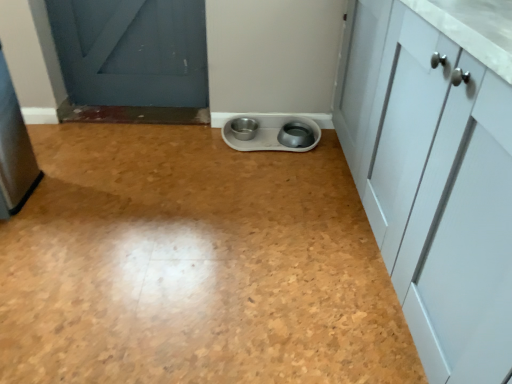
Question: Is metallic gray bowls at center, positioned as the 2th appliance in front-to-back order, touching brushed metal refrigerator at left, marked as the second appliance in a right-to-left arrangement?

Choices:
 (A) yes
 (B) no

Answer: (B)

Question: Can you confirm if metallic gray bowls at center, acting as the 1th appliance starting from the right, is positioned to the right of brushed metal refrigerator at left, marked as the first appliance in a left-to-right arrangement?

Choices:
 (A) yes
 (B) no

Answer: (A)

Question: Can you confirm if metallic gray bowls at center, arranged as the first appliance when viewed from the back, is smaller than brushed metal refrigerator at left, marked as the second appliance in a right-to-left arrangement?

Choices:
 (A) yes
 (B) no

Answer: (A)

Question: Is metallic gray bowls at center, the second appliance in the left-to-right sequence, outside of brushed metal refrigerator at left, the 2th appliance when ordered from back to front?

Choices:
 (A) no
 (B) yes

Answer: (B)

Question: Does metallic gray bowls at center, arranged as the first appliance when viewed from the back, have a lesser width compared to brushed metal refrigerator at left, positioned as the 1th appliance in front-to-back order?

Choices:
 (A) yes
 (B) no

Answer: (A)

Question: Is point (308, 124) closer or farther from the camera than point (264, 344)?

Choices:
 (A) closer
 (B) farther

Answer: (B)

Question: Is metallic gray bowls at center, the second appliance in the left-to-right sequence, spatially inside white plastic pet bowls at center, or outside of it?

Choices:
 (A) outside
 (B) inside

Answer: (A)

Question: Considering their positions, is metallic gray bowls at center, positioned as the 2th appliance in front-to-back order, located in front of or behind white plastic pet bowls at center?

Choices:
 (A) front
 (B) behind

Answer: (B)

Question: In the image, is metallic gray bowls at center, arranged as the first appliance when viewed from the back, on the left side or the right side of white plastic pet bowls at center?

Choices:
 (A) right
 (B) left

Answer: (A)

Question: Looking at their shapes, would you say brushed metal refrigerator at left, marked as the second appliance in a right-to-left arrangement, is wider or thinner than metallic gray bowls at center, acting as the 1th appliance starting from the right?

Choices:
 (A) wide
 (B) thin

Answer: (A)

Question: In the image, is brushed metal refrigerator at left, marked as the second appliance in a right-to-left arrangement, positioned in front of or behind metallic gray bowls at center, arranged as the first appliance when viewed from the back?

Choices:
 (A) behind
 (B) front

Answer: (B)

Question: From the image's perspective, relative to metallic gray bowls at center, acting as the 1th appliance starting from the right, is brushed metal refrigerator at left, marked as the first appliance in a left-to-right arrangement, above or below?

Choices:
 (A) below
 (B) above

Answer: (A)

Question: Considering the relative positions of brushed metal refrigerator at left, marked as the first appliance in a left-to-right arrangement, and metallic gray bowls at center, acting as the 1th appliance starting from the right, in the image provided, is brushed metal refrigerator at left, marked as the first appliance in a left-to-right arrangement, to the left or to the right of metallic gray bowls at center, acting as the 1th appliance starting from the right,?

Choices:
 (A) left
 (B) right

Answer: (A)

Question: Do you think white plastic pet bowls at center is within brushed metal refrigerator at left, marked as the second appliance in a right-to-left arrangement, or outside of it?

Choices:
 (A) outside
 (B) inside

Answer: (A)

Question: Considering the positions of white plastic pet bowls at center and brushed metal refrigerator at left, marked as the first appliance in a left-to-right arrangement, in the image, is white plastic pet bowls at center wider or thinner than brushed metal refrigerator at left, marked as the first appliance in a left-to-right arrangement,?

Choices:
 (A) thin
 (B) wide

Answer: (B)